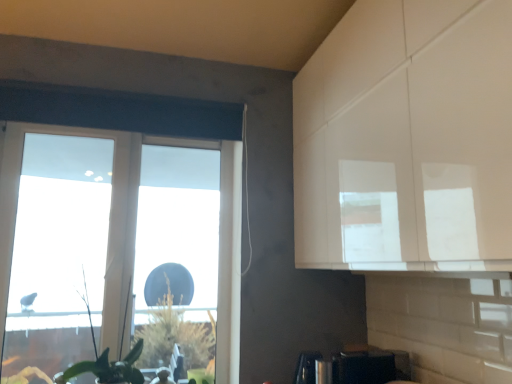
Describe the element at coordinates (109, 364) in the screenshot. I see `green leafy plant at lower left` at that location.

Locate an element on the screen. green leafy plant at lower left is located at coordinates (109, 364).

Measure the distance from green leafy plant at lower left to transparent plastic window at left.

green leafy plant at lower left is 29.98 inches away from transparent plastic window at left.

Is green leafy plant at lower left positioned with its back to transparent plastic window at left?

Yes, transparent plastic window at left is at the back of green leafy plant at lower left.

Considering the sizes of green leafy plant at lower left and transparent plastic window at left in the image, is green leafy plant at lower left bigger or smaller than transparent plastic window at left?

Clearly, green leafy plant at lower left is smaller in size than transparent plastic window at left.

Is transparent plastic window at left oriented towards green leafy plant at lower left?

Yes, transparent plastic window at left is oriented towards green leafy plant at lower left.

Measure the distance from transparent plastic window at left to green leafy plant at lower left.

transparent plastic window at left is 76.16 centimeters away from green leafy plant at lower left.

I want to click on plant below the transparent plastic window at left (from the image's perspective), so click(109, 364).

Considering the sizes of transparent plastic window at left and green leafy plant at lower left in the image, is transparent plastic window at left wider or thinner than green leafy plant at lower left?

Considering their sizes, transparent plastic window at left looks slimmer than green leafy plant at lower left.

Does point (351, 373) appear closer or farther from the camera than point (106, 367)?

Point (351, 373) is positioned closer to the camera compared to point (106, 367).

Is satin black toaster at lower center with green leafy plant at lower left?

No, satin black toaster at lower center is not making contact with green leafy plant at lower left.

You are a GUI agent. You are given a task and a screenshot of the screen. Output one action in this format:
    pyautogui.click(x=<x>, y=<y>)
    Task: Click on the appliance in front of the green leafy plant at lower left
    Image resolution: width=512 pixels, height=384 pixels.
    Given the screenshot: What is the action you would take?
    pyautogui.click(x=360, y=366)

Is satin black toaster at lower center further to the viewer compared to green leafy plant at lower left?

No, satin black toaster at lower center is in front of green leafy plant at lower left.

Consider the image. From the image's perspective, is transparent plastic window at left on satin black toaster at lower center?

Yes, from the image's perspective, transparent plastic window at left is over satin black toaster at lower center.

Which of these two, transparent plastic window at left or satin black toaster at lower center, is bigger?

With larger size is transparent plastic window at left.

There is a satin black toaster at lower center. In order to click on window above it (from a real-world perspective) in this screenshot , I will do `click(100, 221)`.

From the picture: Is transparent plastic window at left turned away from satin black toaster at lower center?

transparent plastic window at left does not have its back to satin black toaster at lower center.

Is satin black toaster at lower center oriented towards transparent plastic window at left?

No, satin black toaster at lower center is not facing towards transparent plastic window at left.

Is satin black toaster at lower center outside of transparent plastic window at left?

That's correct, satin black toaster at lower center is outside of transparent plastic window at left.

Between satin black toaster at lower center and transparent plastic window at left, which one has less height?

satin black toaster at lower center is shorter.

Measure the distance between satin black toaster at lower center and transparent plastic window at left.

satin black toaster at lower center and transparent plastic window at left are 1.37 meters apart from each other.

Does green leafy plant at lower left have a larger size compared to satin black toaster at lower center?

Yes, green leafy plant at lower left is bigger than satin black toaster at lower center.

From the image's perspective, which one is positioned lower, green leafy plant at lower left or satin black toaster at lower center?

satin black toaster at lower center.

Which of these two, green leafy plant at lower left or satin black toaster at lower center, is wider?

satin black toaster at lower center is wider.

I want to click on plant lying behind the satin black toaster at lower center, so [109, 364].

Locate an element on the screen. The width and height of the screenshot is (512, 384). plant in front of the transparent plastic window at left is located at coordinates (109, 364).

Where is `plant that appears on the right of transparent plastic window at left`? This screenshot has height=384, width=512. plant that appears on the right of transparent plastic window at left is located at coordinates (109, 364).

When comparing their distances from satin black toaster at lower center, does green leafy plant at lower left or transparent plastic window at left seem further?

transparent plastic window at left.

Estimate the real-world distances between objects in this image. Which object is closer to transparent plastic window at left, green leafy plant at lower left or satin black toaster at lower center?

green leafy plant at lower left is positioned closer to the anchor transparent plastic window at left.

Considering their positions, is transparent plastic window at left positioned further to green leafy plant at lower left than satin black toaster at lower center?

Among the two, satin black toaster at lower center is located further to green leafy plant at lower left.

When comparing their distances from satin black toaster at lower center, does transparent plastic window at left or green leafy plant at lower left seem closer?

Based on the image, green leafy plant at lower left appears to be nearer to satin black toaster at lower center.

From the image, which object appears to be farther from transparent plastic window at left, satin black toaster at lower center or green leafy plant at lower left?

Among the two, satin black toaster at lower center is located further to transparent plastic window at left.

Estimate the real-world distances between objects in this image. Which object is closer to green leafy plant at lower left, satin black toaster at lower center or transparent plastic window at left?

transparent plastic window at left is closer to green leafy plant at lower left.

I want to click on plant between transparent plastic window at left and satin black toaster at lower center, so click(109, 364).